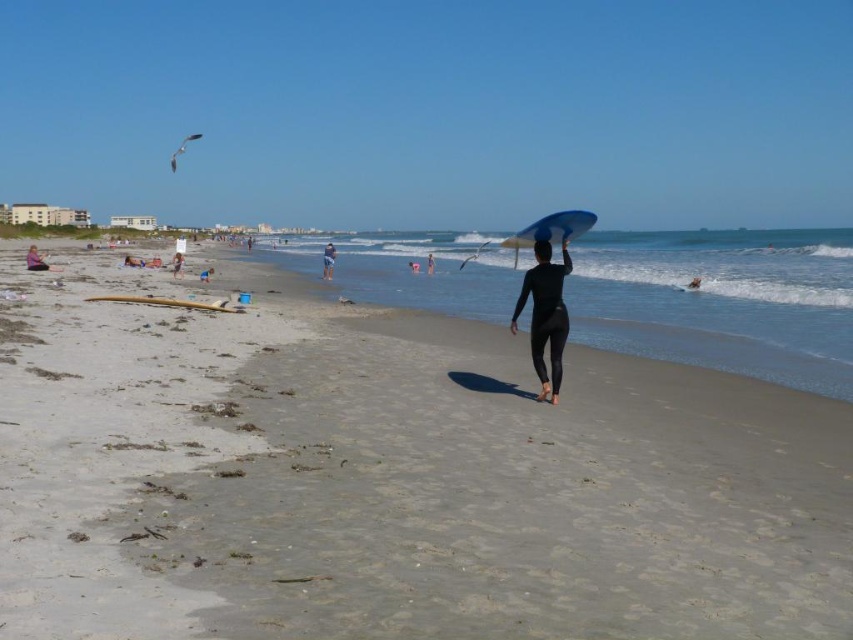
Question: Based on their relative distances, which object is farther from the matte black surfboard at left?

Choices:
 (A) black wetsuit at center
 (B) white cotton shirt at center
 (C) smooth black wetsuit at center
 (D) blue matte surfboard at center

Answer: (D)

Question: Which of the following is the farthest from the observer?

Choices:
 (A) (695, 276)
 (B) (410, 262)
 (C) (206, 276)
 (D) (186, 307)

Answer: (B)

Question: Is wooden surfboard at lower left positioned behind blue fabric surfboard at center?

Choices:
 (A) yes
 (B) no

Answer: (B)

Question: Which of the following is the farthest from the observer?

Choices:
 (A) (415, 260)
 (B) (212, 269)

Answer: (A)

Question: Can you confirm if matte black wetsuit at center is smaller than black wetsuit at center?

Choices:
 (A) no
 (B) yes

Answer: (A)

Question: In this image, where is light brown wooden surfboard at lower left located relative to smooth black wetsuit at center?

Choices:
 (A) below
 (B) above

Answer: (B)